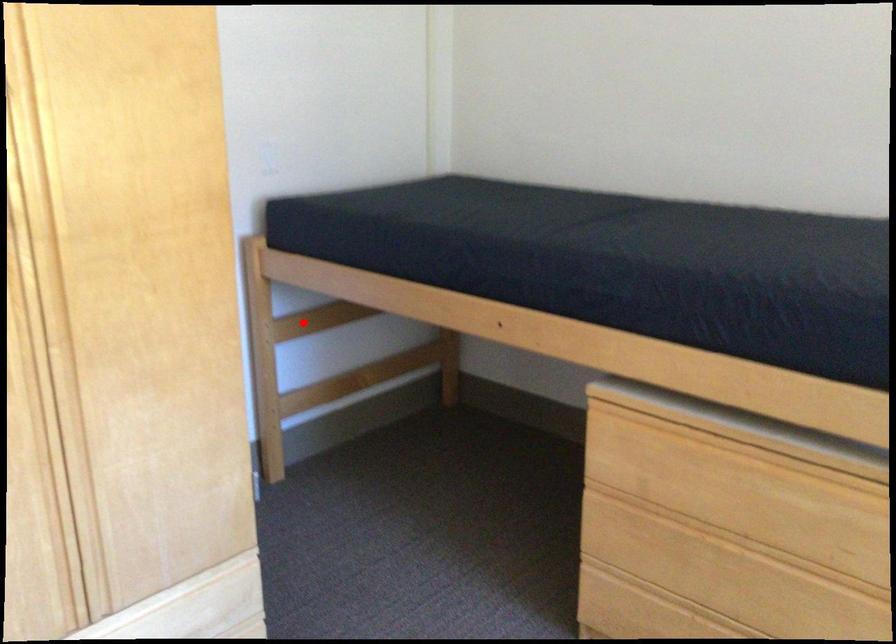
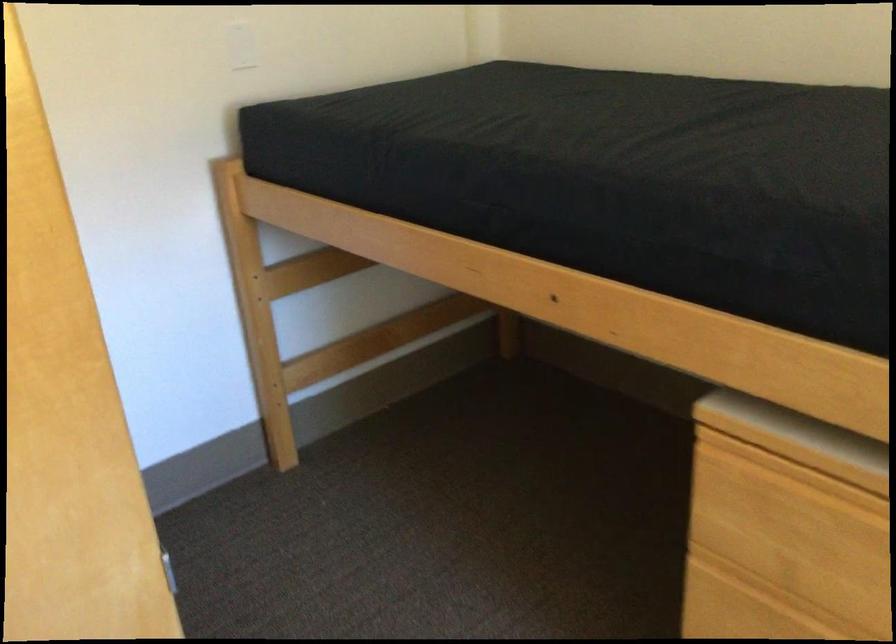
In the second image, find the point that corresponds to the highlighted location in the first image.

(307, 270)